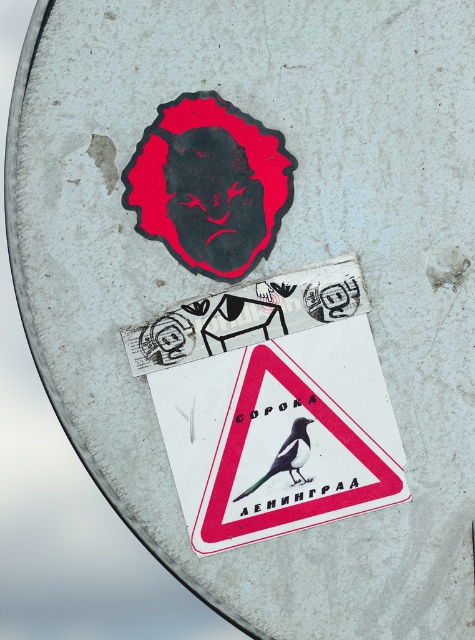
You are a maintenance worker inspecting a signpost. You notice two stickers on the metallic surface. One is a white paper triangle at center and the other is a green glossy bird at center. Which sticker is positioned higher up on the signpost?

The white paper triangle at center is positioned higher up on the signpost than the green glossy bird at center.

You are a delivery robot that needs to scan two items on a metallic surface. The items are the white paper triangle at center and the green glossy bird at center. Which one is positioned to the left?

The white paper triangle at center is positioned to the left of the green glossy bird at center.